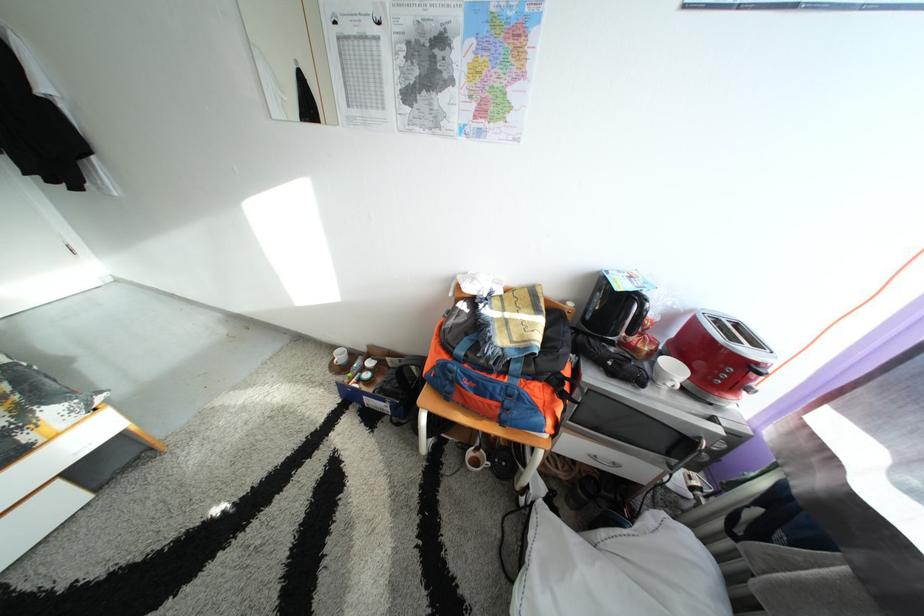
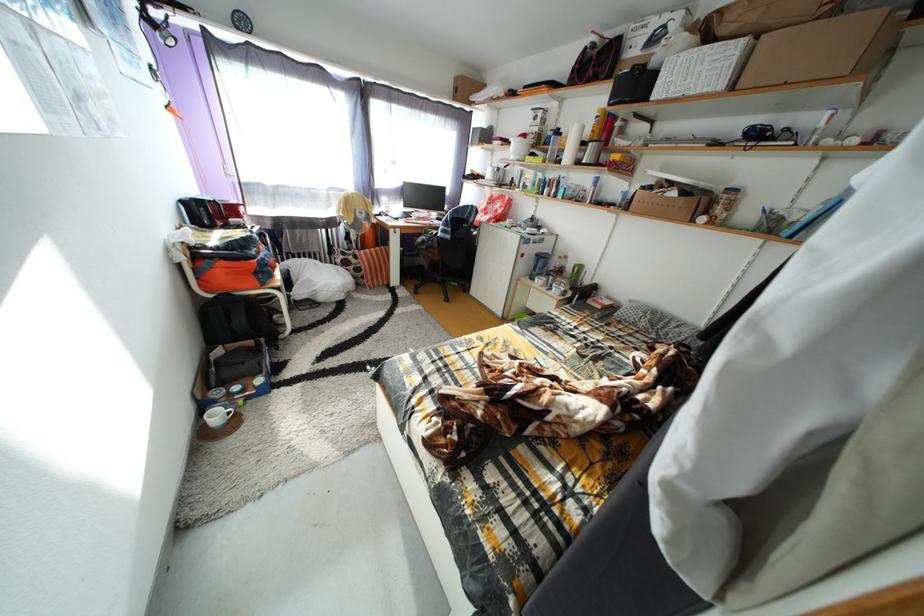
Question: I am providing you with two images of the same scene from different viewpoints. After the viewpoint changes to image2, which objects are now occluded?

Choices:
 (A) black spine book
 (B) toaster lever
 (C) black office chair armrest
 (D) small red book

Answer: (B)